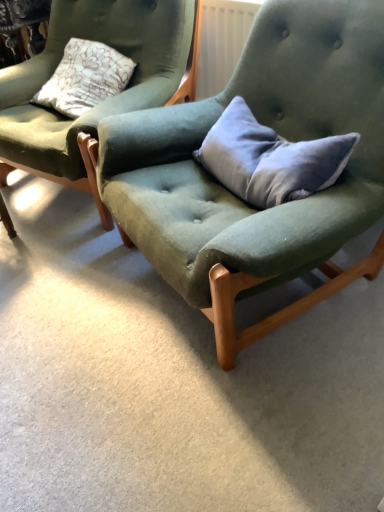
How much space does velvet green chair at center, marked as the 2th chair in a right-to-left arrangement, occupy vertically?

The height of velvet green chair at center, marked as the 2th chair in a right-to-left arrangement, is 33.00 inches.

What do you see at coordinates (237, 197) in the screenshot? I see `velvet green chair at center, the second chair from the left` at bounding box center [237, 197].

Locate an element on the screen. velvet green chair at center, marked as the 2th chair in a right-to-left arrangement is located at coordinates (105, 102).

In terms of height, does velvet green chair at center, which is counted as the 1th chair, starting from the left, look taller or shorter compared to velvet green chair at center, placed as the 1th chair when sorted from right to left?

velvet green chair at center, which is counted as the 1th chair, starting from the left, is shorter than velvet green chair at center, placed as the 1th chair when sorted from right to left.

Is velvet green chair at center, marked as the 2th chair in a right-to-left arrangement, facing away from velvet green chair at center, the second chair from the left?

No, velvet green chair at center, the second chair from the left, is not at the back of velvet green chair at center, marked as the 2th chair in a right-to-left arrangement.

Consider the image. From the image's perspective, would you say velvet green chair at center, marked as the 2th chair in a right-to-left arrangement, is shown under velvet green chair at center, placed as the 1th chair when sorted from right to left?

No, from the image's perspective, velvet green chair at center, marked as the 2th chair in a right-to-left arrangement, is not beneath velvet green chair at center, placed as the 1th chair when sorted from right to left.

Would you say velvet green chair at center, marked as the 2th chair in a right-to-left arrangement, is a long distance from velvet green chair at center, placed as the 1th chair when sorted from right to left?

That's not correct — velvet green chair at center, marked as the 2th chair in a right-to-left arrangement, is a little close to velvet green chair at center, placed as the 1th chair when sorted from right to left.

In order to click on pillow located above the velvet green chair at center, which is counted as the 1th chair, starting from the left (from a real-world perspective) in this screenshot , I will do `click(270, 159)`.

Is velvet green chair at center, which is counted as the 1th chair, starting from the left, taller or shorter than gray velvet pillow at center?

Clearly, velvet green chair at center, which is counted as the 1th chair, starting from the left, is taller compared to gray velvet pillow at center.

Considering the relative sizes of velvet green chair at center, which is counted as the 1th chair, starting from the left, and gray velvet pillow at center in the image provided, is velvet green chair at center, which is counted as the 1th chair, starting from the left, smaller than gray velvet pillow at center?

No.

Is gray velvet pillow at center positioned beyond the bounds of velvet green chair at center, the second chair from the left?

No, gray velvet pillow at center is inside or overlapping with velvet green chair at center, the second chair from the left.

Which object is closer to the camera, gray velvet pillow at center or velvet green chair at center, the second chair from the left?

velvet green chair at center, the second chair from the left, is closer to the camera.

Is gray velvet pillow at center aimed at velvet green chair at center, placed as the 1th chair when sorted from right to left?

Yes, gray velvet pillow at center is turned towards velvet green chair at center, placed as the 1th chair when sorted from right to left.

From the image's perspective, is velvet green chair at center, placed as the 1th chair when sorted from right to left, below velvet green chair at center, which is counted as the 1th chair, starting from the left?

Yes, from the image's perspective, velvet green chair at center, placed as the 1th chair when sorted from right to left, is beneath velvet green chair at center, which is counted as the 1th chair, starting from the left.

Is velvet green chair at center, the second chair from the left, far from velvet green chair at center, which is counted as the 1th chair, starting from the left?

No, velvet green chair at center, the second chair from the left, is not far away from velvet green chair at center, which is counted as the 1th chair, starting from the left.

Is velvet green chair at center, the second chair from the left, oriented away from velvet green chair at center, which is counted as the 1th chair, starting from the left?

No.

Looking at this image, which of these two, velvet green chair at center, the second chair from the left, or velvet green chair at center, which is counted as the 1th chair, starting from the left, is bigger?

velvet green chair at center, the second chair from the left.

Is point (297, 147) positioned before point (141, 5)?

Yes, it is.

Which is behind, gray velvet pillow at center or velvet green chair at center, which is counted as the 1th chair, starting from the left?

velvet green chair at center, which is counted as the 1th chair, starting from the left.

Is gray velvet pillow at center not within velvet green chair at center, marked as the 2th chair in a right-to-left arrangement?

Yes, gray velvet pillow at center is not within velvet green chair at center, marked as the 2th chair in a right-to-left arrangement.

Does gray velvet pillow at center have a lesser width compared to velvet green chair at center, marked as the 2th chair in a right-to-left arrangement?

Indeed, gray velvet pillow at center has a lesser width compared to velvet green chair at center, marked as the 2th chair in a right-to-left arrangement.

Who is smaller, velvet green chair at center, the second chair from the left, or gray velvet pillow at center?

With smaller size is gray velvet pillow at center.

From a real-world perspective, is velvet green chair at center, the second chair from the left, physically located above or below gray velvet pillow at center?

From a real-world perspective, velvet green chair at center, the second chair from the left, is physically below gray velvet pillow at center.

Is point (233, 232) closer or farther from the camera than point (340, 173)?

Point (233, 232).

Is velvet green chair at center, the second chair from the left, positioned beyond the bounds of gray velvet pillow at center?

velvet green chair at center, the second chair from the left, is positioned outside gray velvet pillow at center.

Image resolution: width=384 pixels, height=512 pixels. In order to click on chair that appears below the velvet green chair at center, marked as the 2th chair in a right-to-left arrangement (from a real-world perspective) in this screenshot , I will do `click(237, 197)`.

Locate an element on the screen. pillow positioned vertically above the velvet green chair at center, which is counted as the 1th chair, starting from the left (from a real-world perspective) is located at coordinates (270, 159).

From the image, which object appears to be nearer to velvet green chair at center, the second chair from the left, gray velvet pillow at center or velvet green chair at center, marked as the 2th chair in a right-to-left arrangement?

gray velvet pillow at center lies closer to velvet green chair at center, the second chair from the left, than the other object.

When comparing their distances from gray velvet pillow at center, does velvet green chair at center, which is counted as the 1th chair, starting from the left, or velvet green chair at center, the second chair from the left, seem closer?

Based on the image, velvet green chair at center, the second chair from the left, appears to be nearer to gray velvet pillow at center.

Considering their positions, is velvet green chair at center, placed as the 1th chair when sorted from right to left, positioned further to velvet green chair at center, which is counted as the 1th chair, starting from the left, than gray velvet pillow at center?

gray velvet pillow at center lies further to velvet green chair at center, which is counted as the 1th chair, starting from the left, than the other object.

When comparing their distances from velvet green chair at center, placed as the 1th chair when sorted from right to left, does velvet green chair at center, which is counted as the 1th chair, starting from the left, or gray velvet pillow at center seem further?

velvet green chair at center, which is counted as the 1th chair, starting from the left, lies further to velvet green chair at center, placed as the 1th chair when sorted from right to left, than the other object.

From the image, which object appears to be farther from gray velvet pillow at center, velvet green chair at center, the second chair from the left, or velvet green chair at center, marked as the 2th chair in a right-to-left arrangement?

velvet green chair at center, marked as the 2th chair in a right-to-left arrangement.

Considering their positions, is gray velvet pillow at center positioned further to velvet green chair at center, which is counted as the 1th chair, starting from the left, than velvet green chair at center, placed as the 1th chair when sorted from right to left?

gray velvet pillow at center is positioned further to the anchor velvet green chair at center, which is counted as the 1th chair, starting from the left.

You are a GUI agent. You are given a task and a screenshot of the screen. Output one action in this format:
    pyautogui.click(x=<x>, y=<y>)
    Task: Click on the chair located between velvet green chair at center, marked as the 2th chair in a right-to-left arrangement, and gray velvet pillow at center in the left-right direction
    This screenshot has width=384, height=512.
    Given the screenshot: What is the action you would take?
    pyautogui.click(x=237, y=197)